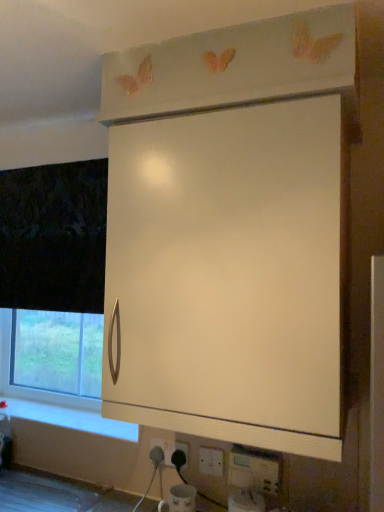
Image resolution: width=384 pixels, height=512 pixels. Identify the location of white plastic electric outlet at lower center, the second electric outlet when ordered from back to front. (211, 461).

What do you see at coordinates (211, 461) in the screenshot? I see `white plastic electric outlet at lower center, the 2th electric outlet in the right-to-left sequence` at bounding box center [211, 461].

Describe the element at coordinates (230, 275) in the screenshot. I see `white matte cabinet at upper center` at that location.

Locate an element on the screen. white plastic electric outlet at lower center, the 1th electric outlet from the left is located at coordinates (164, 449).

Between white plastic electric outlet at lower center, the 1th electric outlet from the left, and white plastic electric outlet at lower center, which is counted as the third electric outlet, starting from the left, which one is positioned in front?

white plastic electric outlet at lower center, which is counted as the third electric outlet, starting from the left.

Is white plastic electric outlet at lower center, which is the third electric outlet in front-to-back order, placed right next to white plastic electric outlet at lower center, marked as the 1th electric outlet in a front-to-back arrangement?

No, white plastic electric outlet at lower center, which is the third electric outlet in front-to-back order, is not beside white plastic electric outlet at lower center, marked as the 1th electric outlet in a front-to-back arrangement.

Is white plastic electric outlet at lower center, which is the third electric outlet in front-to-back order, turned away from white plastic electric outlet at lower center, which is counted as the third electric outlet, starting from the left?

white plastic electric outlet at lower center, which is the third electric outlet in front-to-back order, does not have its back to white plastic electric outlet at lower center, which is counted as the third electric outlet, starting from the left.

Looking at this image, considering the sizes of objects white plastic electric outlet at lower center, marked as the third electric outlet in a right-to-left arrangement, and white plastic electric outlet at lower center, which is counted as the third electric outlet, starting from the left, in the image provided, who is taller, white plastic electric outlet at lower center, marked as the third electric outlet in a right-to-left arrangement, or white plastic electric outlet at lower center, which is counted as the third electric outlet, starting from the left,?

With more height is white plastic electric outlet at lower center, which is counted as the third electric outlet, starting from the left.

Is white plastic electric outlet at lower center, placed as the first electric outlet when sorted from right to left, positioned far away from white plastic electric outlet at lower center, arranged as the first electric outlet when viewed from the back?

That's not correct — white plastic electric outlet at lower center, placed as the first electric outlet when sorted from right to left, is a little close to white plastic electric outlet at lower center, arranged as the first electric outlet when viewed from the back.

From the image's perspective, is white plastic electric outlet at lower center, placed as the first electric outlet when sorted from right to left, over white plastic electric outlet at lower center, marked as the third electric outlet in a right-to-left arrangement?

Yes.

Find the location of a particular element. Image resolution: width=384 pixels, height=512 pixels. the 1st electric outlet located beneath the white plastic electric outlet at lower center, which is counted as the third electric outlet, starting from the left (from a real-world perspective) is located at coordinates (164, 449).

How many degrees apart are the facing directions of white plastic electric outlet at lower center, which is counted as the third electric outlet, starting from the left, and white plastic electric outlet at lower center, marked as the third electric outlet in a right-to-left arrangement?

The facing directions of white plastic electric outlet at lower center, which is counted as the third electric outlet, starting from the left, and white plastic electric outlet at lower center, marked as the third electric outlet in a right-to-left arrangement, are 1.01 degrees apart.

Starting from the white plastic electric outlet at lower center, arranged as the first electric outlet when viewed from the back, which electric outlet is the 1st one in front? Please provide its 2D coordinates.

[(211, 461)]

How different are the orientations of white plastic electric outlet at lower center, which is the third electric outlet in front-to-back order, and white plastic electric outlet at lower center, the 2th electric outlet in the right-to-left sequence, in degrees?

There is a 0.504-degree angle between the facing directions of white plastic electric outlet at lower center, which is the third electric outlet in front-to-back order, and white plastic electric outlet at lower center, the 2th electric outlet in the right-to-left sequence.

Which point is more distant from viewer, (x=168, y=463) or (x=210, y=469)?

The point (x=168, y=463) is farther.

Is white matte cabinet at upper center bigger than white plastic electric outlet at lower center, marked as the third electric outlet in a right-to-left arrangement?

Yes, white matte cabinet at upper center is bigger than white plastic electric outlet at lower center, marked as the third electric outlet in a right-to-left arrangement.

Can you confirm if white matte cabinet at upper center is wider than white plastic electric outlet at lower center, the 1th electric outlet from the left?

Indeed, white matte cabinet at upper center has a greater width compared to white plastic electric outlet at lower center, the 1th electric outlet from the left.

Looking at this image, from the image's perspective, between white matte cabinet at upper center and white plastic electric outlet at lower center, which is the third electric outlet in front-to-back order, who is located below?

white plastic electric outlet at lower center, which is the third electric outlet in front-to-back order, appears lower in the image.

From a real-world perspective, is white plastic electric outlet at lower center, the 2th electric outlet in the right-to-left sequence, located higher than white matte cabinet at upper center?

No, from a real-world perspective, white plastic electric outlet at lower center, the 2th electric outlet in the right-to-left sequence, is not on top of white matte cabinet at upper center.

In terms of height, does white plastic electric outlet at lower center, positioned as the 2th electric outlet in left-to-right order, look taller or shorter compared to white matte cabinet at upper center?

Clearly, white plastic electric outlet at lower center, positioned as the 2th electric outlet in left-to-right order, is shorter compared to white matte cabinet at upper center.

From the picture: Can white matte cabinet at upper center be found inside white plastic electric outlet at lower center, the 2th electric outlet in the right-to-left sequence?

No, white matte cabinet at upper center is located outside of white plastic electric outlet at lower center, the 2th electric outlet in the right-to-left sequence.

Considering the relative positions of white plastic electric outlet at lower center, the 2th electric outlet in the right-to-left sequence, and white matte cabinet at upper center in the image provided, is white plastic electric outlet at lower center, the 2th electric outlet in the right-to-left sequence, to the left or to the right of white matte cabinet at upper center?

white plastic electric outlet at lower center, the 2th electric outlet in the right-to-left sequence, is positioned on white matte cabinet at upper center's left side.

Is white plastic electric outlet at lower center, placed as the first electric outlet when sorted from right to left, aimed at white matte cabinet at upper center?

No, white plastic electric outlet at lower center, placed as the first electric outlet when sorted from right to left, does not turn towards white matte cabinet at upper center.

From a real-world perspective, count 1st electric outlets downward from the white matte cabinet at upper center and point to it. Please provide its 2D coordinates.

[(254, 470)]

Is white plastic electric outlet at lower center, placed as the first electric outlet when sorted from right to left, behind white matte cabinet at upper center?

Yes, it is behind white matte cabinet at upper center.

Could you tell me if white plastic electric outlet at lower center, arranged as the first electric outlet when viewed from the back, is turned towards white matte cabinet at upper center?

No, white plastic electric outlet at lower center, arranged as the first electric outlet when viewed from the back, is not turned towards white matte cabinet at upper center.

Does white plastic electric outlet at lower center, arranged as the first electric outlet when viewed from the back, appear on the right side of white matte cabinet at upper center?

No, white plastic electric outlet at lower center, arranged as the first electric outlet when viewed from the back, is not to the right of white matte cabinet at upper center.

Which point is more distant from viewer, (165, 456) or (293, 223)?

The point (165, 456) is farther from the camera.

From the image's perspective, between white plastic electric outlet at lower center, marked as the third electric outlet in a right-to-left arrangement, and white matte cabinet at upper center, who is located below?

white plastic electric outlet at lower center, marked as the third electric outlet in a right-to-left arrangement, appears lower in the image.

This screenshot has height=512, width=384. I want to click on electric outlet above the white plastic electric outlet at lower center, the 1th electric outlet from the left (from a real-world perspective), so click(254, 470).

The height and width of the screenshot is (512, 384). I want to click on the 2nd electric outlet counting from the left of the white plastic electric outlet at lower center, placed as the first electric outlet when sorted from right to left, so 164,449.

Looking at the image, which one is located closer to white plastic electric outlet at lower center, which is the third electric outlet in front-to-back order, white plastic electric outlet at lower center, the second electric outlet when ordered from back to front, or white matte cabinet at upper center?

white plastic electric outlet at lower center, the second electric outlet when ordered from back to front, is positioned closer to the anchor white plastic electric outlet at lower center, which is the third electric outlet in front-to-back order.

When comparing their distances from white plastic electric outlet at lower center, marked as the 1th electric outlet in a front-to-back arrangement, does white plastic electric outlet at lower center, the 2th electric outlet in the right-to-left sequence, or white matte cabinet at upper center seem further?

Based on the image, white matte cabinet at upper center appears to be further to white plastic electric outlet at lower center, marked as the 1th electric outlet in a front-to-back arrangement.

When comparing their distances from white matte cabinet at upper center, does white plastic electric outlet at lower center, the second electric outlet in the front-to-back sequence, or white plastic electric outlet at lower center, which is counted as the third electric outlet, starting from the left, seem further?

Among the two, white plastic electric outlet at lower center, the second electric outlet in the front-to-back sequence, is located further to white matte cabinet at upper center.

Which object lies nearer to the anchor point white plastic electric outlet at lower center, the 2th electric outlet in the right-to-left sequence, white plastic electric outlet at lower center, which is the third electric outlet in front-to-back order, or white matte cabinet at upper center?

white plastic electric outlet at lower center, which is the third electric outlet in front-to-back order, is closer to white plastic electric outlet at lower center, the 2th electric outlet in the right-to-left sequence.

Estimate the real-world distances between objects in this image. Which object is further from white matte cabinet at upper center, white plastic electric outlet at lower center, the 1th electric outlet from the left, or white plastic electric outlet at lower center, placed as the third electric outlet when sorted from back to front?

white plastic electric outlet at lower center, the 1th electric outlet from the left.

When comparing their distances from white matte cabinet at upper center, does white plastic electric outlet at lower center, placed as the first electric outlet when sorted from right to left, or white plastic electric outlet at lower center, marked as the third electric outlet in a right-to-left arrangement, seem closer?

white plastic electric outlet at lower center, placed as the first electric outlet when sorted from right to left, is closer to white matte cabinet at upper center.

From the image, which object appears to be farther from white plastic electric outlet at lower center, marked as the third electric outlet in a right-to-left arrangement, white matte cabinet at upper center or white plastic electric outlet at lower center, placed as the third electric outlet when sorted from back to front?

white matte cabinet at upper center is further to white plastic electric outlet at lower center, marked as the third electric outlet in a right-to-left arrangement.

When comparing their distances from white plastic electric outlet at lower center, which is counted as the third electric outlet, starting from the left, does white plastic electric outlet at lower center, arranged as the first electric outlet when viewed from the back, or white plastic electric outlet at lower center, positioned as the 2th electric outlet in left-to-right order, seem closer?

The object closer to white plastic electric outlet at lower center, which is counted as the third electric outlet, starting from the left, is white plastic electric outlet at lower center, positioned as the 2th electric outlet in left-to-right order.

At what (x,y) coordinates should I click in order to perform the action: click on electric outlet between white plastic electric outlet at lower center, marked as the third electric outlet in a right-to-left arrangement, and white plastic electric outlet at lower center, which is counted as the third electric outlet, starting from the left, in the horizontal direction. Please return your answer as a coordinate pair (x, y). The height and width of the screenshot is (512, 384). Looking at the image, I should click on (211, 461).

Locate an element on the screen. Image resolution: width=384 pixels, height=512 pixels. electric outlet between white matte cabinet at upper center and white plastic electric outlet at lower center, arranged as the first electric outlet when viewed from the back, vertically is located at coordinates pyautogui.click(x=254, y=470).